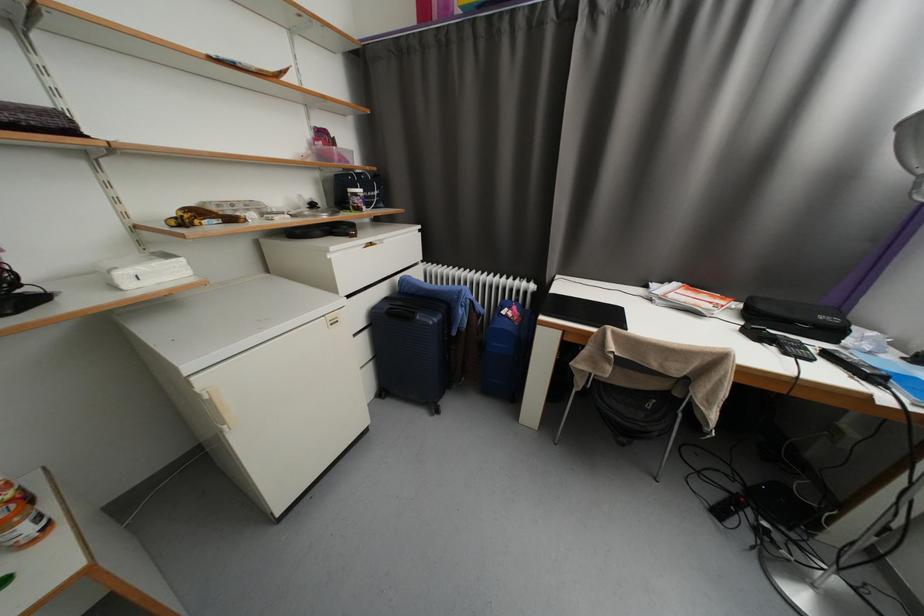
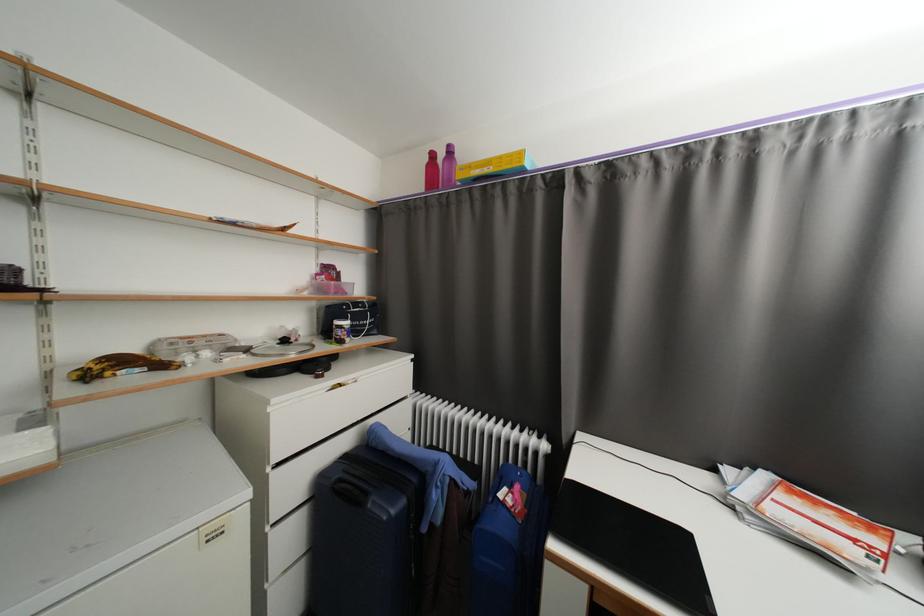
The point at (320, 207) is marked in the first image. Where is the corresponding point in the second image?

(290, 342)